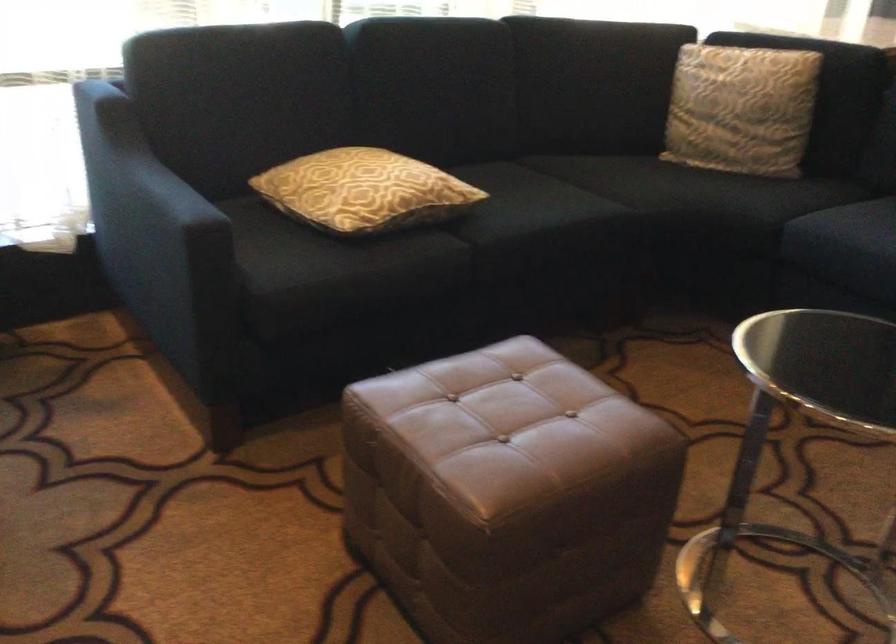
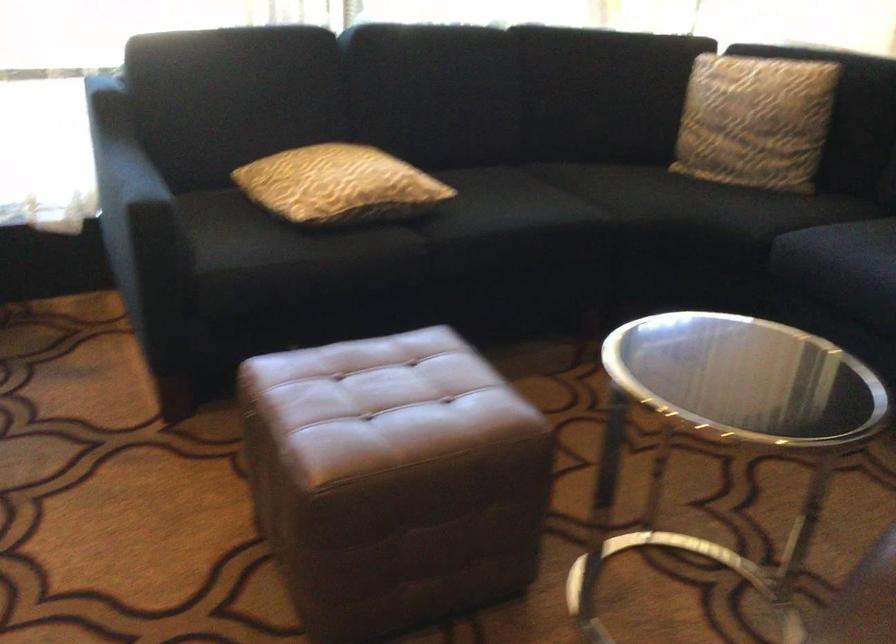
Find the pixel in the second image that matches (x=746, y=109) in the first image.

(754, 120)